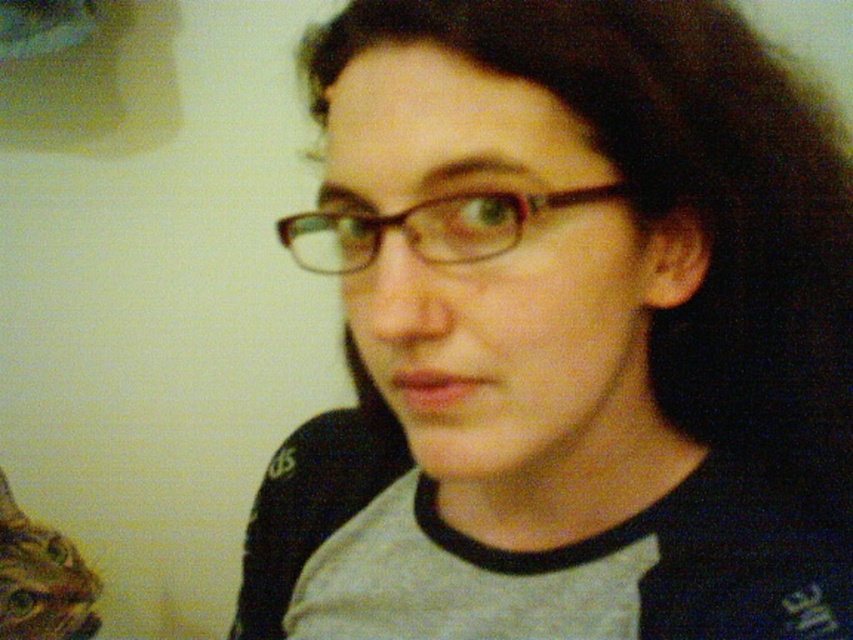
You are a photographer setting up a shoot. You have two pairs of glasses in the scene, the matte plastic glasses at center and the brown plastic glasses at center. Based on their positions, which pair is closer to the camera?

The matte plastic glasses at center is located below the brown plastic glasses at center, so the brown plastic glasses at center is closer to the camera.

You are taking a photo of two points in the scene. The first point is at coordinates point (590, 269) and the second point is at point (486, 248). Which point is closer to the camera?

Point (486, 248) is closer to the camera because point (590, 269) is behind it.

You are a photographer setting up a shoot. You have two pairs of glasses on the table in front of you, the matte plastic glasses at center and the brown plastic glasses at center. You need to choose the wider pair to place in the main focus area of your photo. Which pair should you select?

The matte plastic glasses at center is wider than the brown plastic glasses at center, so you should select the matte plastic glasses at center for the main focus area.